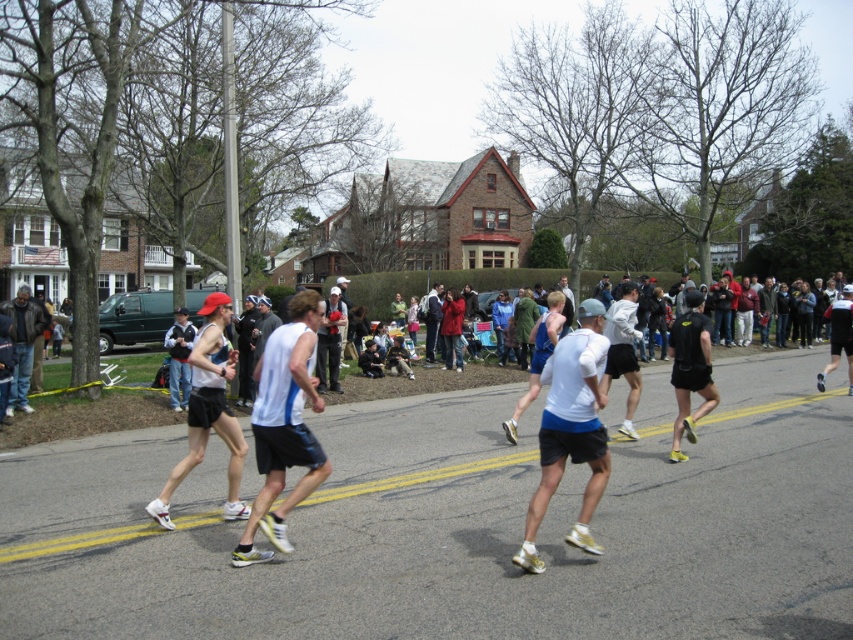
You are a photographer at the marathon event. You want to capture a photo that includes both the white matte shirt at center and the dark gray leather jacket at left. Which object should you zoom in on to ensure both are clearly visible in the frame?

You should zoom in on the white matte shirt at center because it is larger in size than the dark gray leather jacket at left, making it easier to frame both objects clearly.

From the picture: You are a photographer at the marathon event and want to capture a photo of both the white matte shirt at center and the matte white tank top at center. From the perspective of someone facing the runners, which clothing item is positioned to the left?

The matte white tank top at center is positioned to the left of the white matte shirt at center.

You are a runner in the marathon and you see a dark gray leather jacket at left located at point (22, 344). Where should you place your left foot to avoid stepping on it?

Place your left foot to the right of the dark gray leather jacket at left located at point (22, 344) to avoid stepping on it.